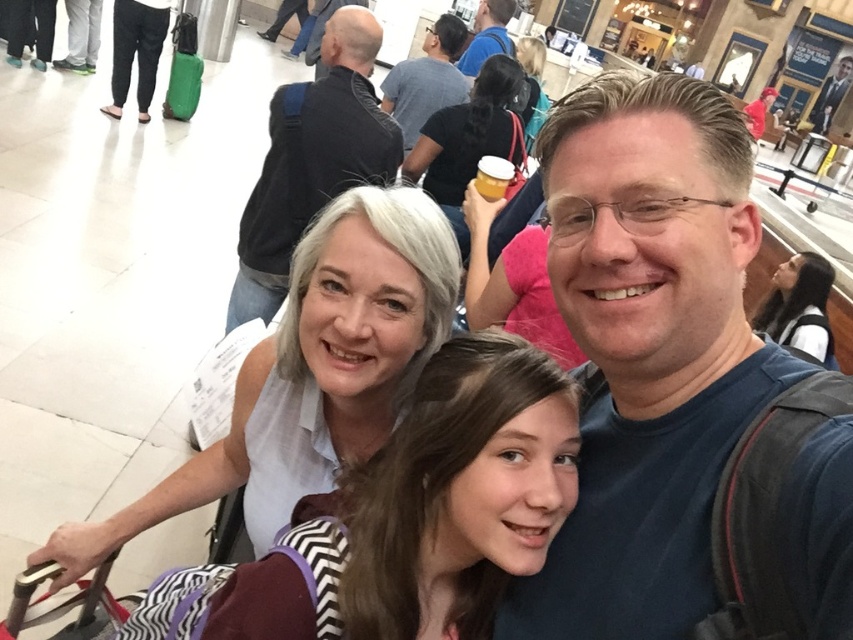
Can you confirm if matte black coffee cup at upper center is taller than dark gray shirt at upper center?

Yes.

Describe the element at coordinates (469, 140) in the screenshot. I see `matte black coffee cup at upper center` at that location.

Is point (424, 132) behind point (437, 49)?

No, it is in front of (437, 49).

You are a GUI agent. You are given a task and a screenshot of the screen. Output one action in this format:
    pyautogui.click(x=<x>, y=<y>)
    Task: Click on the matte black coffee cup at upper center
    Image resolution: width=853 pixels, height=640 pixels.
    Given the screenshot: What is the action you would take?
    tap(469, 140)

Between dark blue t-shirt at center and matte black coffee cup at upper center, which one has less height?

dark blue t-shirt at center is shorter.

Who is more distant from viewer, [647,598] or [445,116]?

Point [445,116]

What are the coordinates of `dark blue t-shirt at center` in the screenshot? It's located at (647, 349).

Does point (225, 320) come closer to viewer compared to point (485, 44)?

That is True.

Is black cotton shirt at upper center to the right of matte black backpack at upper center from the viewer's perspective?

In fact, black cotton shirt at upper center is to the left of matte black backpack at upper center.

Between point (297, 129) and point (498, 26), which one is positioned in front?

Point (297, 129)

At what (x,y) coordinates should I click in order to perform the action: click on black cotton shirt at upper center. Please return your answer as a coordinate pair (x, y). This screenshot has height=640, width=853. Looking at the image, I should click on (312, 161).